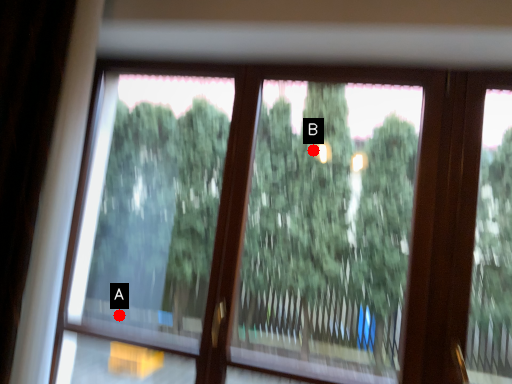
Question: Two points are circled on the image, labeled by A and B beside each circle. Which point is farther from the camera taking this photo?

Choices:
 (A) A is further
 (B) B is further

Answer: (A)